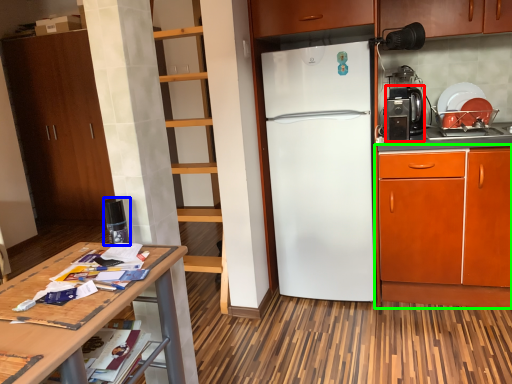
Question: Based on their relative distances, which object is farther from coffee machine (highlighted by a red box)? Choose from appliance (highlighted by a blue box) and cabinetry (highlighted by a green box).

Choices:
 (A) appliance
 (B) cabinetry

Answer: (A)